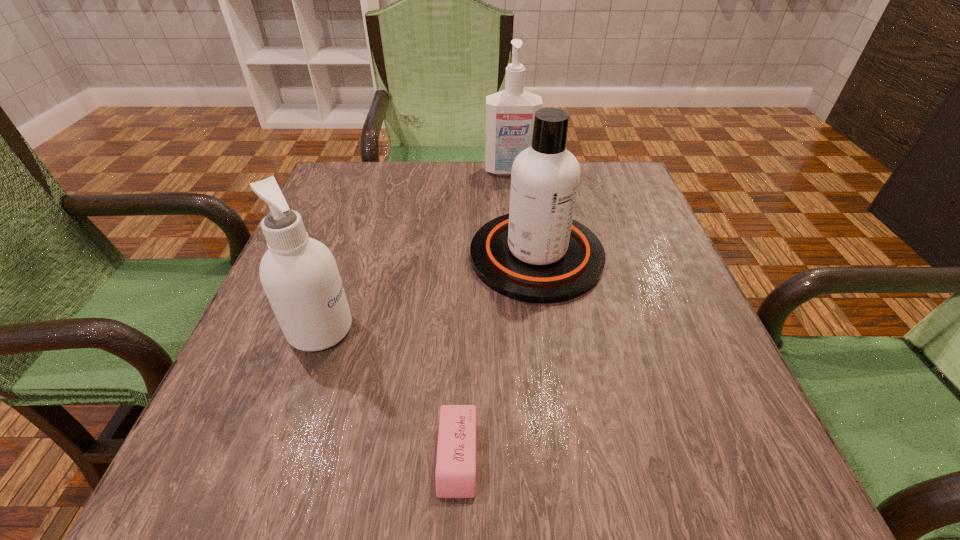
The image size is (960, 540). In order to click on free spot between the eraser and the leftmost cleansing agent in this screenshot , I will do `click(389, 392)`.

This screenshot has width=960, height=540. In order to click on free space between the nearest object and the second farthest cleansing agent in this screenshot , I will do `click(497, 356)`.

Locate an element on the screen. The width and height of the screenshot is (960, 540). empty location between the nearest object and the farthest object is located at coordinates (484, 313).

Where is `vacant area that lies between the leftmost cleansing agent and the second farthest object`? This screenshot has width=960, height=540. vacant area that lies between the leftmost cleansing agent and the second farthest object is located at coordinates (428, 292).

The image size is (960, 540). Find the location of `vacant space that's between the second farthest cleansing agent and the nearest object`. vacant space that's between the second farthest cleansing agent and the nearest object is located at coordinates (497, 356).

I want to click on blank region between the shortest object and the second farthest cleansing agent, so click(x=497, y=356).

Identify the location of free area in between the eraser and the farthest cleansing agent. (484, 313).

Locate an element on the screen. This screenshot has width=960, height=540. blank region between the eraser and the second farthest cleansing agent is located at coordinates pyautogui.click(x=497, y=356).

Where is `the third closest object relative to the leftmost object`? the third closest object relative to the leftmost object is located at coordinates (510, 113).

You are a GUI agent. You are given a task and a screenshot of the screen. Output one action in this format:
    pyautogui.click(x=<x>, y=<y>)
    Task: Click on the object that is the closest one to the farthest object
    
    Given the screenshot: What is the action you would take?
    coord(537,253)